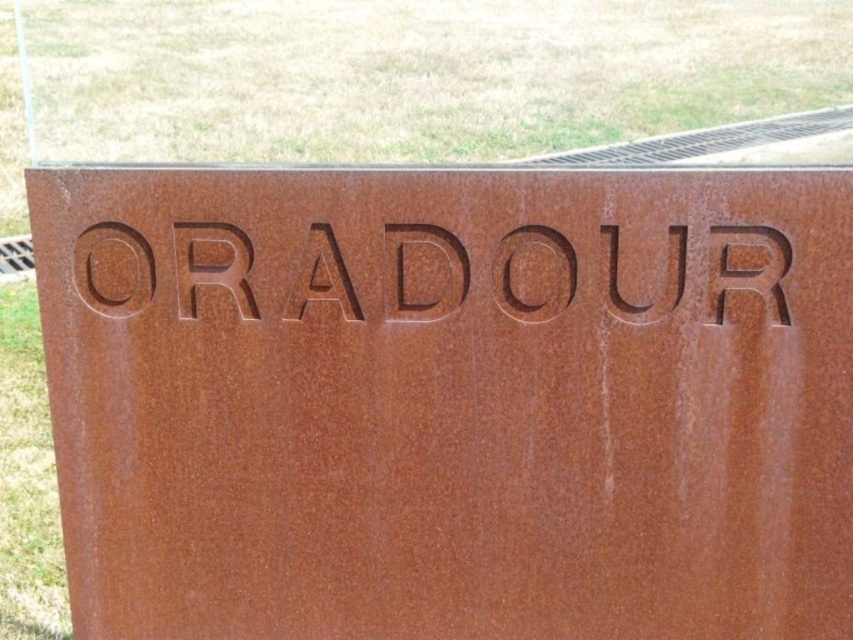
Question: Which of the following is the farthest from the observer?

Choices:
 (A) rusty metal sign at center
 (B) brown grass at upper center

Answer: (B)

Question: Is rusty metal sign at center above brown grass at upper center?

Choices:
 (A) yes
 (B) no

Answer: (B)

Question: Can you confirm if rusty metal sign at center is positioned above brown grass at upper center?

Choices:
 (A) yes
 (B) no

Answer: (B)

Question: Which of the following is the farthest from the observer?

Choices:
 (A) (561, 42)
 (B) (444, 216)

Answer: (A)

Question: Can you confirm if rusty metal sign at center is wider than brown grass at upper center?

Choices:
 (A) no
 (B) yes

Answer: (A)